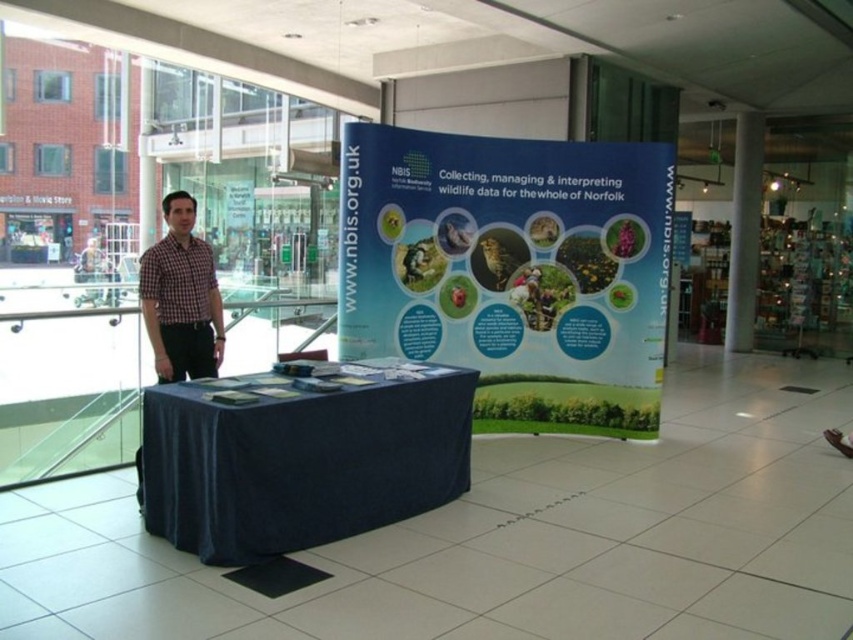
Question: Considering the real-world distances, which object is closest to the checkered fabric shirt at left?

Choices:
 (A) blue fabric table at center
 (B) blue fabric poster at center

Answer: (A)

Question: Is blue fabric poster at center above blue fabric table at center?

Choices:
 (A) no
 (B) yes

Answer: (B)

Question: Which object is the closest to the blue fabric table at center?

Choices:
 (A) blue fabric poster at center
 (B) checkered fabric shirt at left

Answer: (B)

Question: Where is blue fabric table at center located in relation to checkered fabric shirt at left in the image?

Choices:
 (A) left
 (B) right

Answer: (B)

Question: Is blue fabric table at center thinner than checkered fabric shirt at left?

Choices:
 (A) no
 (B) yes

Answer: (A)

Question: Which of the following is the farthest from the observer?

Choices:
 (A) (218, 563)
 (B) (173, 193)
 (C) (337, 328)

Answer: (B)